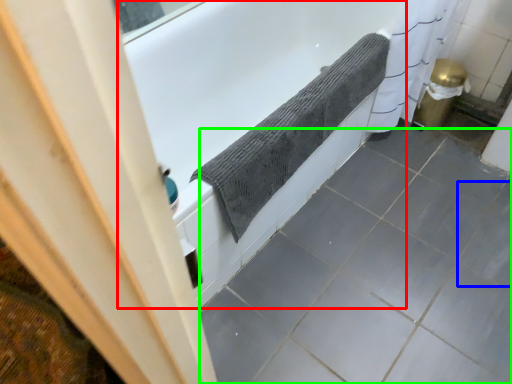
Question: Estimate the real-world distances between objects in this image. Which object is farther from bathtub (highlighted by a red box), ceramic tile (highlighted by a blue box) or ceramic tile (highlighted by a green box)?

Choices:
 (A) ceramic tile
 (B) ceramic tile

Answer: (A)